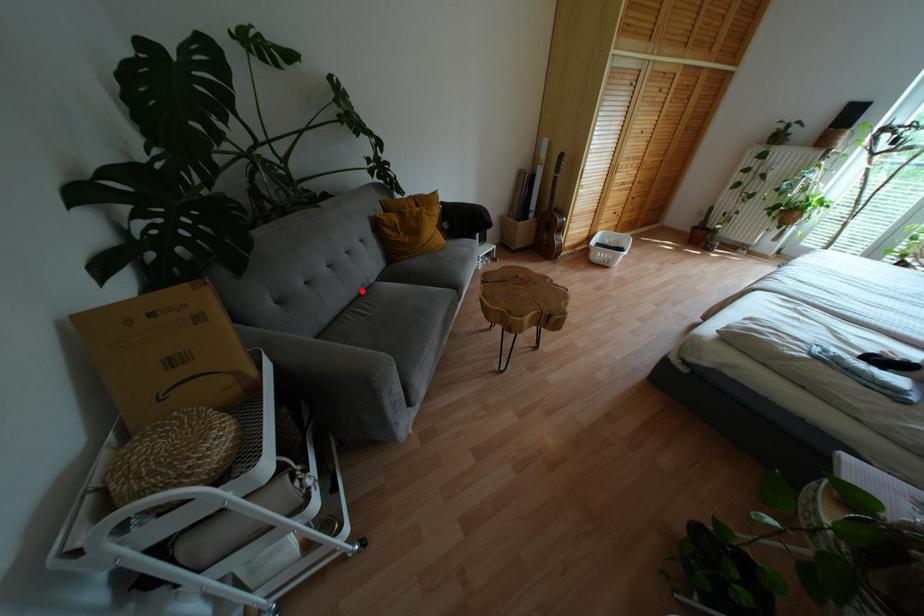
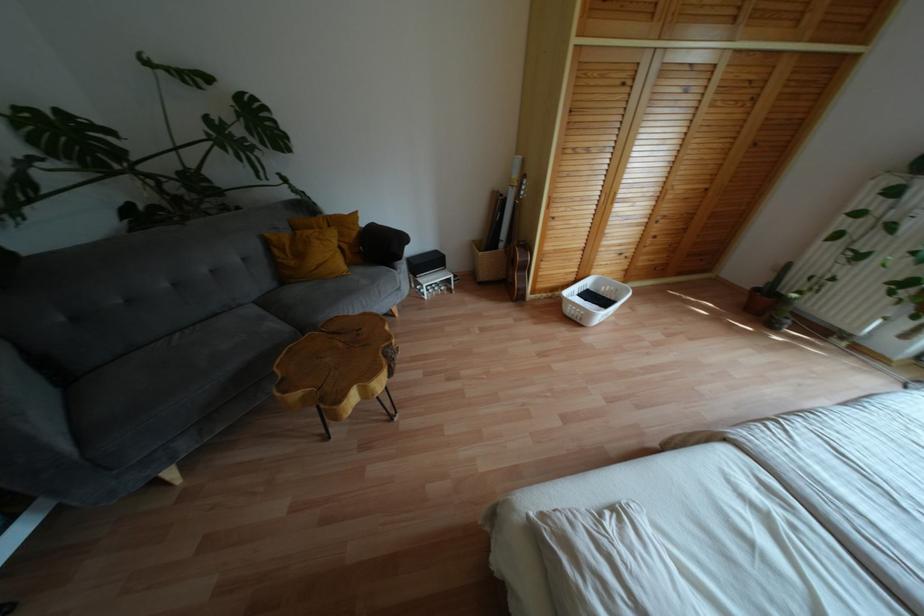
Where in the second image is the point corresponding to the highlighted location from the first image?

(224, 312)